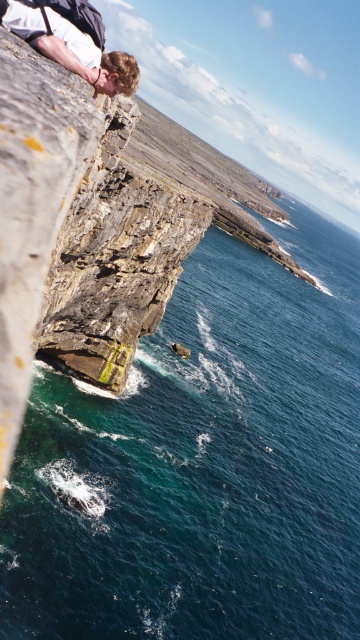
Does blue water at lower left have a lesser width compared to matte white shirt at upper left?

Incorrect, blue water at lower left's width is not less than matte white shirt at upper left's.

You are a GUI agent. You are given a task and a screenshot of the screen. Output one action in this format:
    pyautogui.click(x=<x>, y=<y>)
    Task: Click on the blue water at lower left
    The width and height of the screenshot is (360, 640).
    Given the screenshot: What is the action you would take?
    pyautogui.click(x=201, y=464)

Image resolution: width=360 pixels, height=640 pixels. What do you see at coordinates (201, 464) in the screenshot? I see `blue water at lower left` at bounding box center [201, 464].

Where is `blue water at lower left`? This screenshot has height=640, width=360. blue water at lower left is located at coordinates (201, 464).